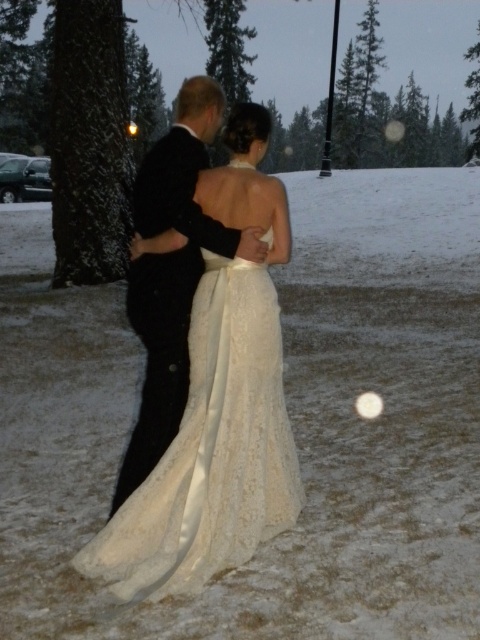
Question: Where is lace satin dress at center located in relation to black satin suit at center in the image?

Choices:
 (A) right
 (B) left

Answer: (A)

Question: Does lace satin dress at center have a smaller size compared to black satin suit at center?

Choices:
 (A) yes
 (B) no

Answer: (A)

Question: Which of the following is the farthest from the observer?

Choices:
 (A) lace satin dress at center
 (B) black satin suit at center

Answer: (B)

Question: Is lace satin dress at center positioned behind black satin suit at center?

Choices:
 (A) yes
 (B) no

Answer: (B)